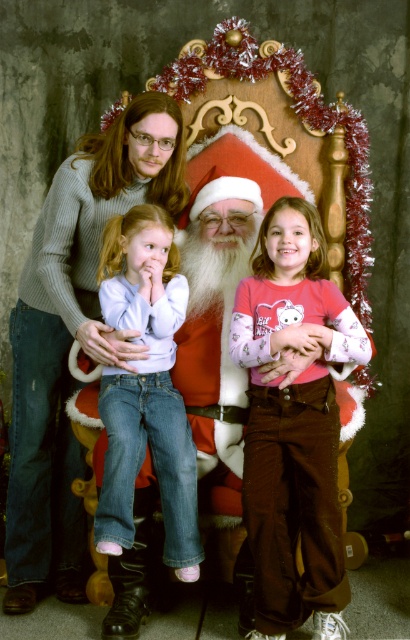
Question: Is pink cotton shirt at center below denim jeans at center?

Choices:
 (A) no
 (B) yes

Answer: (B)

Question: Is pink cotton shirt at center wider than denim jeans at center?

Choices:
 (A) no
 (B) yes

Answer: (B)

Question: Among these points, which one is farthest from the camera?

Choices:
 (A) (314, 371)
 (B) (123, 291)

Answer: (B)

Question: In this image, where is pink cotton shirt at center located relative to denim jeans at center?

Choices:
 (A) above
 (B) below

Answer: (B)